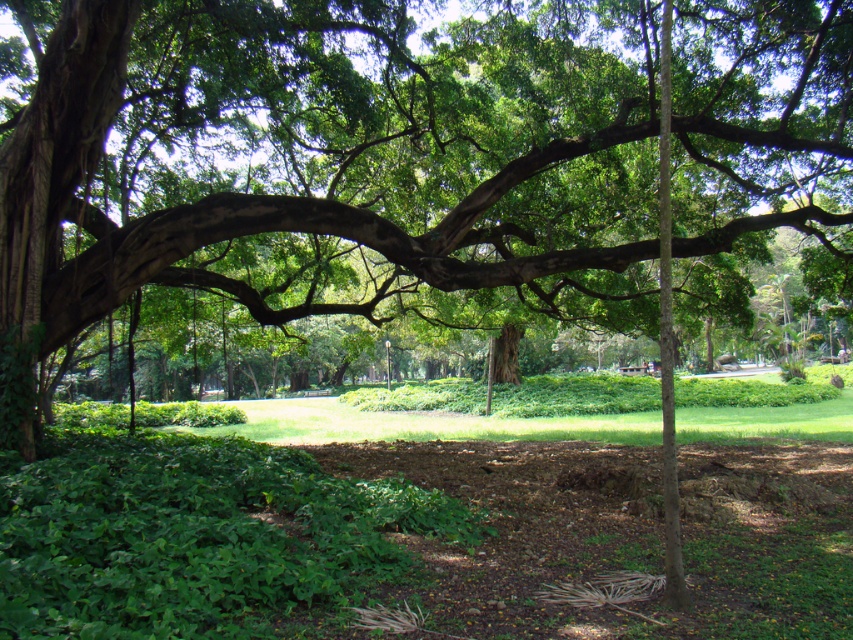
Is green leafy tree at center positioned at the back of green leafy grass at center?

Yes, it is behind green leafy grass at center.

Identify the location of green leafy tree at center. (325, 160).

This screenshot has width=853, height=640. What are the coordinates of `green leafy tree at center` in the screenshot? It's located at (325, 160).